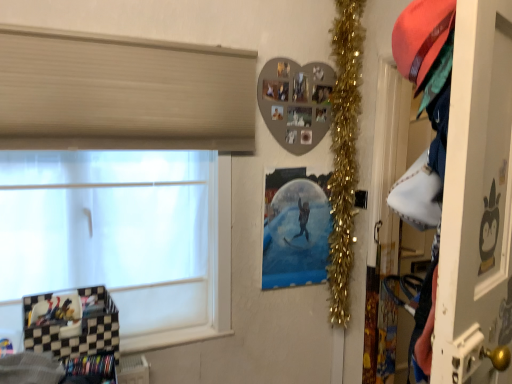
Question: From the image's perspective, does white matte window at left appear higher than metallic silver poster at center?

Choices:
 (A) no
 (B) yes

Answer: (B)

Question: Does white matte window at left have a greater height compared to metallic silver poster at center?

Choices:
 (A) yes
 (B) no

Answer: (A)

Question: Is white matte window at left not inside metallic silver poster at center?

Choices:
 (A) yes
 (B) no

Answer: (A)

Question: Is white matte window at left shorter than metallic silver poster at center?

Choices:
 (A) no
 (B) yes

Answer: (A)

Question: Can you confirm if white matte window at left is positioned to the left of metallic silver poster at center?

Choices:
 (A) yes
 (B) no

Answer: (A)

Question: Is white matte window at left not near metallic silver poster at center?

Choices:
 (A) no
 (B) yes

Answer: (A)

Question: Is white glossy screen door at right smaller than gold tinsel garland at upper right?

Choices:
 (A) yes
 (B) no

Answer: (B)

Question: Is white glossy screen door at right shorter than gold tinsel garland at upper right?

Choices:
 (A) no
 (B) yes

Answer: (B)

Question: Is gold tinsel garland at upper right located within white glossy screen door at right?

Choices:
 (A) no
 (B) yes

Answer: (A)

Question: Considering the relative sizes of white glossy screen door at right and gold tinsel garland at upper right in the image provided, is white glossy screen door at right bigger than gold tinsel garland at upper right?

Choices:
 (A) no
 (B) yes

Answer: (B)

Question: Can you confirm if white glossy screen door at right is positioned to the right of gold tinsel garland at upper right?

Choices:
 (A) yes
 (B) no

Answer: (A)

Question: Does white glossy screen door at right have a lesser width compared to gold tinsel garland at upper right?

Choices:
 (A) yes
 (B) no

Answer: (A)

Question: From a real-world perspective, is gold tinsel garland at upper right located higher than white matte window at left?

Choices:
 (A) no
 (B) yes

Answer: (B)